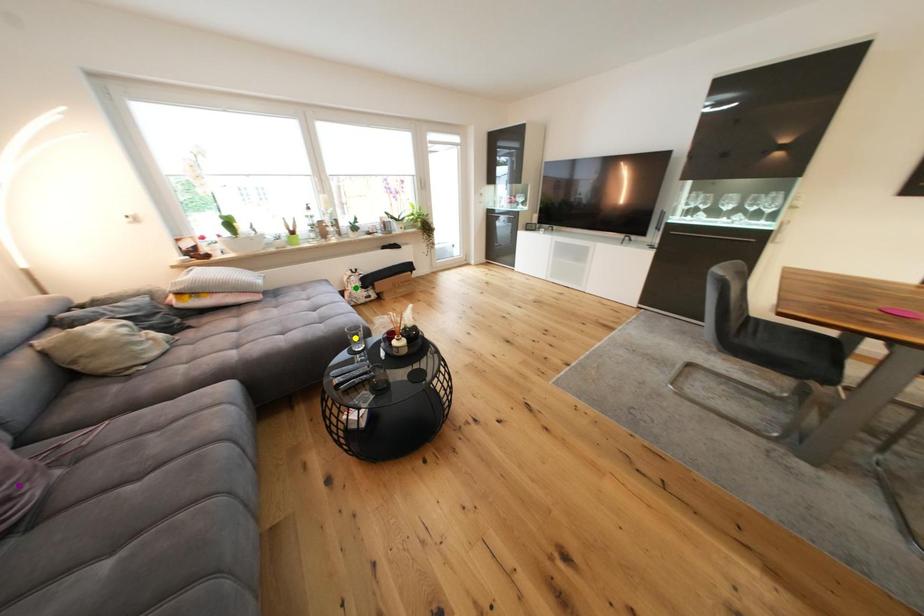
Order these from nearest to farthest:
- purple point
- yellow point
- green point

1. purple point
2. yellow point
3. green point